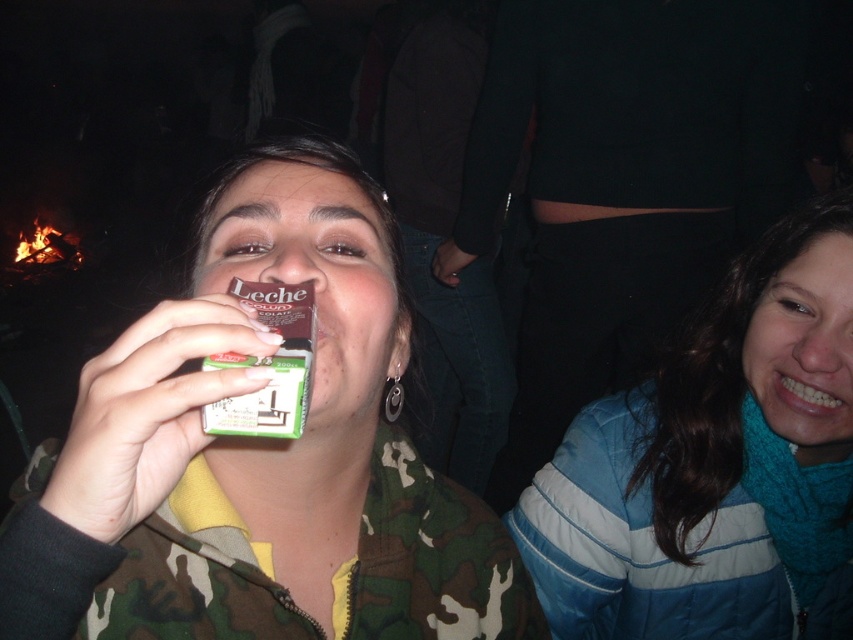
Question: Which of the following is the closest to the observer?

Choices:
 (A) camouflage jacket at center
 (B) blue fleece jacket at lower right

Answer: (A)

Question: Which point appears closest to the camera in this image?

Choices:
 (A) (680, 356)
 (B) (193, 621)

Answer: (B)

Question: Does camouflage jacket at center have a greater width compared to blue fleece jacket at lower right?

Choices:
 (A) no
 (B) yes

Answer: (A)

Question: Does camouflage jacket at center have a smaller size compared to blue fleece jacket at lower right?

Choices:
 (A) yes
 (B) no

Answer: (A)

Question: Where is camouflage jacket at center located in relation to blue fleece jacket at lower right in the image?

Choices:
 (A) below
 (B) above

Answer: (B)

Question: Which point is farther from the camera taking this photo?

Choices:
 (A) (136, 355)
 (B) (680, 525)

Answer: (B)